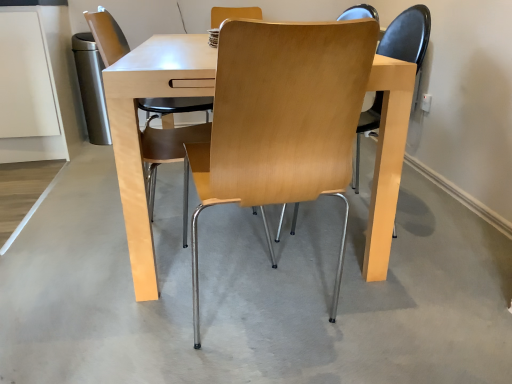
Where is `vacant area that is situated to the right of light wood/matte chair at center, the 2th chair viewed from the right`? vacant area that is situated to the right of light wood/matte chair at center, the 2th chair viewed from the right is located at coordinates (303, 240).